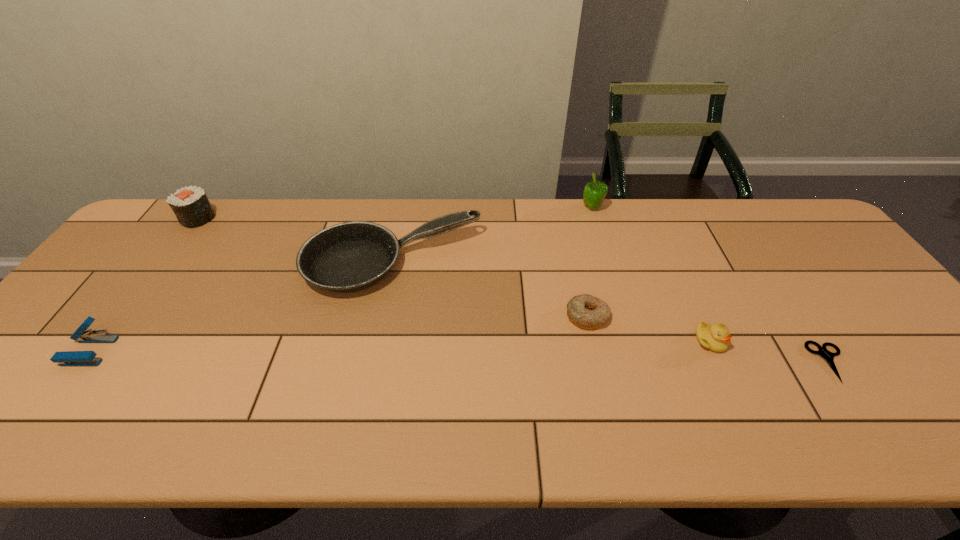
This screenshot has height=540, width=960. What are the coordinates of `shears` in the screenshot? It's located at (827, 355).

Where is `vacant space located on the left of the fifth object from left to right`? vacant space located on the left of the fifth object from left to right is located at coordinates (557, 208).

In order to click on vacant area situated 0.400m on the front of the sushi in this screenshot , I will do click(116, 330).

Identify the location of vacant space located on the left of the fifth object from right to left. (216, 264).

Identify the location of vacant space situated on the front of the stapler. The image size is (960, 540). (60, 390).

Locate an element on the screen. Image resolution: width=960 pixels, height=540 pixels. vacant space situated 0.060m on the front-facing side of the sixth object from left to right is located at coordinates (727, 376).

I want to click on vacant region located on the back of the fourth object from left to right, so click(568, 232).

Locate an element on the screen. The width and height of the screenshot is (960, 540). vacant space located on the left of the shortest object is located at coordinates (692, 363).

This screenshot has height=540, width=960. What are the coordinates of `bell pepper that is at the far edge` in the screenshot? It's located at (594, 193).

Identify the location of sushi located at the far edge. The height and width of the screenshot is (540, 960). (190, 205).